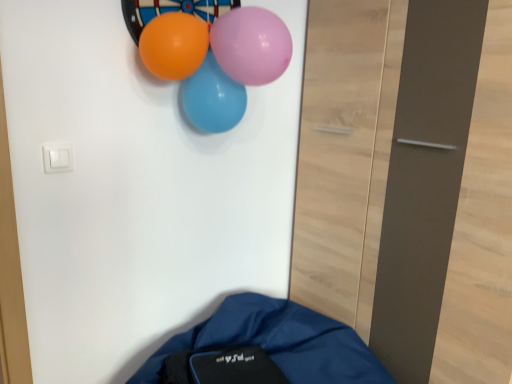
Question: Is purple glossy balloon at upper center, which is the 3th balloon in back-to-front order, at the right side of blue glossy balloon at upper center, the third balloon from the front?

Choices:
 (A) no
 (B) yes

Answer: (B)

Question: Can you confirm if purple glossy balloon at upper center, placed as the first balloon when sorted from front to back, is positioned to the left of blue glossy balloon at upper center, arranged as the 1th balloon when viewed from the back?

Choices:
 (A) no
 (B) yes

Answer: (A)

Question: Is purple glossy balloon at upper center, which is the 3th balloon in back-to-front order, thinner than blue glossy balloon at upper center, arranged as the 1th balloon when viewed from the back?

Choices:
 (A) yes
 (B) no

Answer: (B)

Question: Is the position of purple glossy balloon at upper center, placed as the first balloon when sorted from front to back, more distant than that of blue glossy balloon at upper center, arranged as the 1th balloon when viewed from the back?

Choices:
 (A) yes
 (B) no

Answer: (B)

Question: Does purple glossy balloon at upper center, which is the 3th balloon in back-to-front order, have a larger size compared to blue glossy balloon at upper center, arranged as the 1th balloon when viewed from the back?

Choices:
 (A) yes
 (B) no

Answer: (B)

Question: Is purple glossy balloon at upper center, which is the 3th balloon in back-to-front order, wider or thinner than orange glossy balloon at upper center, arranged as the 2th balloon when viewed from the front?

Choices:
 (A) thin
 (B) wide

Answer: (B)

Question: From a real-world perspective, is purple glossy balloon at upper center, placed as the first balloon when sorted from front to back, positioned above or below orange glossy balloon at upper center, arranged as the 2th balloon when viewed from the front?

Choices:
 (A) above
 (B) below

Answer: (A)

Question: Is purple glossy balloon at upper center, which is the 3th balloon in back-to-front order, bigger or smaller than orange glossy balloon at upper center, arranged as the 2th balloon when viewed from the front?

Choices:
 (A) small
 (B) big

Answer: (B)

Question: Is purple glossy balloon at upper center, which is the 3th balloon in back-to-front order, in front of or behind orange glossy balloon at upper center, arranged as the 2th balloon when viewed from the front, in the image?

Choices:
 (A) front
 (B) behind

Answer: (A)

Question: From the image's perspective, is purple glossy balloon at upper center, placed as the first balloon when sorted from front to back, located above or below blue glossy balloon at upper center, arranged as the 1th balloon when viewed from the back?

Choices:
 (A) above
 (B) below

Answer: (A)

Question: From a real-world perspective, is purple glossy balloon at upper center, placed as the first balloon when sorted from front to back, above or below blue glossy balloon at upper center, arranged as the 1th balloon when viewed from the back?

Choices:
 (A) below
 (B) above

Answer: (B)

Question: Considering their positions, is purple glossy balloon at upper center, which is the 3th balloon in back-to-front order, located in front of or behind blue glossy balloon at upper center, the third balloon from the front?

Choices:
 (A) behind
 (B) front

Answer: (B)

Question: Considering the relative positions of purple glossy balloon at upper center, placed as the first balloon when sorted from front to back, and blue glossy balloon at upper center, arranged as the 1th balloon when viewed from the back, in the image provided, is purple glossy balloon at upper center, placed as the first balloon when sorted from front to back, to the left or to the right of blue glossy balloon at upper center, arranged as the 1th balloon when viewed from the back,?

Choices:
 (A) right
 (B) left

Answer: (A)

Question: Is orange glossy balloon at upper center, the 2th balloon positioned from the back, wider or thinner than purple glossy balloon at upper center, placed as the first balloon when sorted from front to back?

Choices:
 (A) thin
 (B) wide

Answer: (A)

Question: From the image's perspective, is orange glossy balloon at upper center, the 2th balloon positioned from the back, positioned above or below purple glossy balloon at upper center, placed as the first balloon when sorted from front to back?

Choices:
 (A) below
 (B) above

Answer: (A)